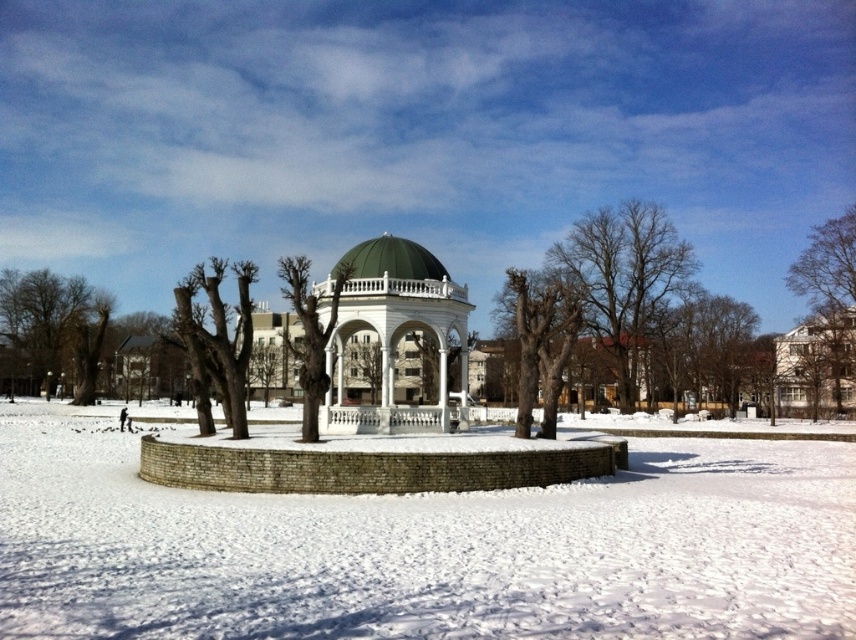
Question: Which point is farther to the camera?

Choices:
 (A) green dome at center
 (B) bare wood trees at center

Answer: (B)

Question: Is bare wood tree at right thinner than green dome at center?

Choices:
 (A) no
 (B) yes

Answer: (A)

Question: Which point is farther to the camera?

Choices:
 (A) (845, 294)
 (B) (616, 208)
 (C) (408, 272)
 (D) (545, 353)

Answer: (B)

Question: Does white marble gazebo at center appear over bare wood tree at upper right?

Choices:
 (A) yes
 (B) no

Answer: (B)

Question: Which object is farther from the camera taking this photo?

Choices:
 (A) bare wood tree at right
 (B) white marble gazebo at center

Answer: (A)

Question: Can you confirm if bare wood tree at upper right is positioned above bare wood tree at left?

Choices:
 (A) no
 (B) yes

Answer: (B)